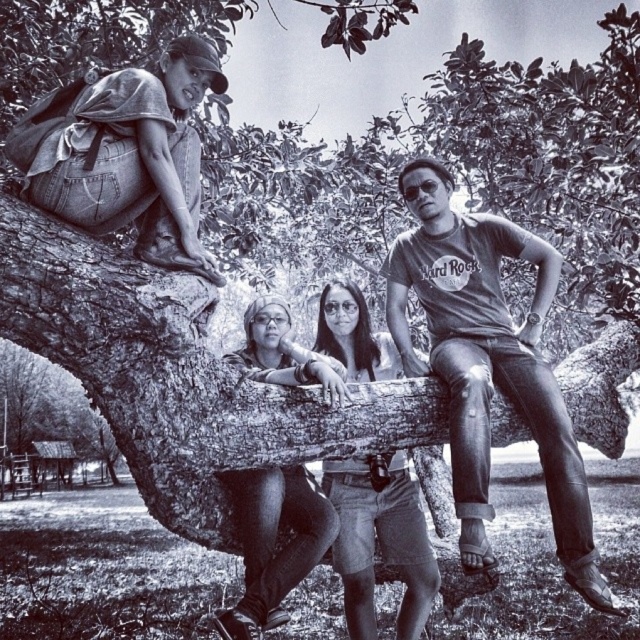
You are a photographer trying to capture the denim shorts at center in the image. Based on their position coordinates, where should you focus your camera to ensure the shorts are in the frame?

The denim shorts at center are located at coordinates point [380,540], so focusing the camera at that point will ensure the shorts are in the frame.